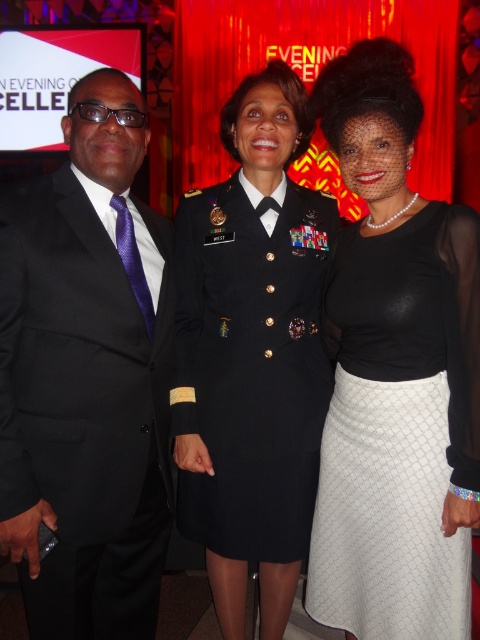
You are a photographer at the event and want to adjust the lighting so that both the black satin suit at left and the white textured skirt at right are equally visible. Given their positions, which one might need more light adjustment and why?

The black satin suit at left is closer to the viewer than the white textured skirt at right. Since the black suit is closer, it may require less light adjustment because it naturally appears more prominent in the foreground. The white skirt, being farther back, might need more light to ensure it stands out against the backdrop.

You are standing in the room where the photo was taken and want to hand a small gift to the person wearing the shiny black dress at center without approaching closer than 3 meters. Is this possible?

The shiny black dress at center and viewer are 3.64 meters apart from each other, so yes, you can hand the gift without approaching closer than 3 meters since the distance is sufficient.

Consider the image. You are a photographer adjusting the lighting for a photo shoot. You need to ensure that the black satin suit at left is properly lit. Which direction should you position the light relative to the camera to avoid shadows on the suit?

To avoid shadows on the black satin suit at left, position the light directly in front of the camera, aligned with the subject to ensure even illumination without casting shadows.